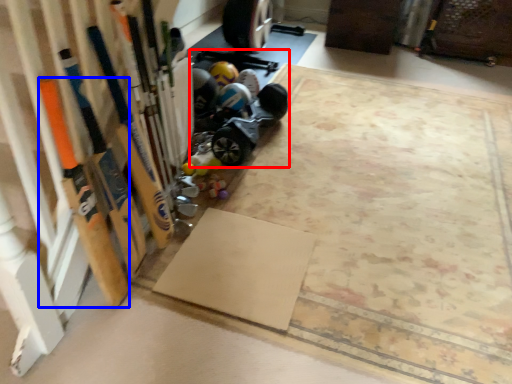
Question: Which point is closer to the camera, car (highlighted by a red box) or baseball bat (highlighted by a blue box)?

Choices:
 (A) car
 (B) baseball bat

Answer: (B)